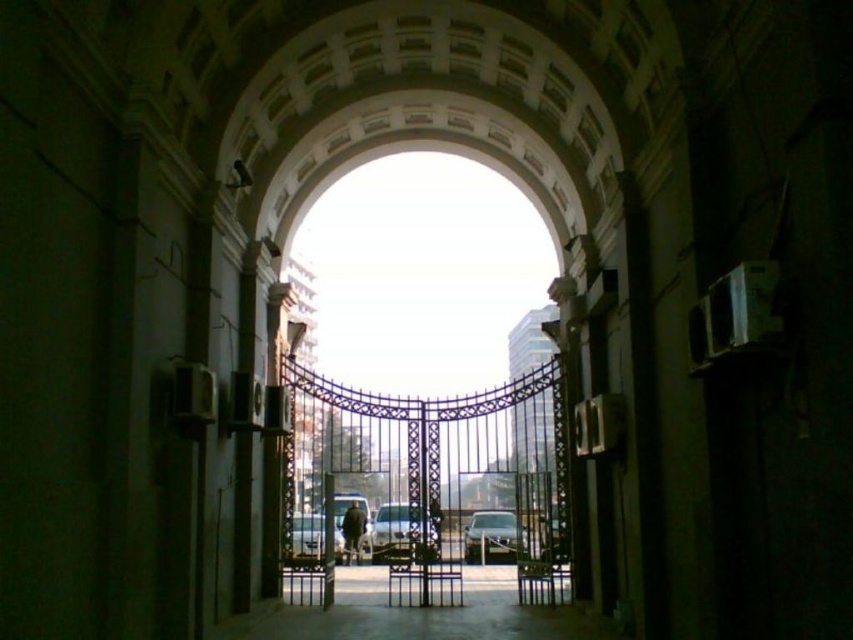
Consider the image. Is silver metallic van at center taller than dark fabric jacket at center?

Yes, silver metallic van at center is taller than dark fabric jacket at center.

Is silver metallic van at center thinner than dark fabric jacket at center?

No.

What do you see at coordinates (399, 531) in the screenshot? I see `silver metallic van at center` at bounding box center [399, 531].

You are a GUI agent. You are given a task and a screenshot of the screen. Output one action in this format:
    pyautogui.click(x=<x>, y=<y>)
    Task: Click on the silver metallic van at center
    This screenshot has width=853, height=640.
    Given the screenshot: What is the action you would take?
    pyautogui.click(x=399, y=531)

Who is more distant from viewer, (489, 554) or (292, 548)?

The point (489, 554) is more distant.

Which is more to the left, satin silver car at center or silver metallic car at center?

silver metallic car at center is more to the left.

Which is in front, point (473, 524) or point (312, 534)?

Point (312, 534)

Locate an element on the screen. The image size is (853, 640). satin silver car at center is located at coordinates (492, 538).

Does silver metallic van at center have a lesser height compared to satin silver car at center?

No.

Is silver metallic van at center thinner than satin silver car at center?

In fact, silver metallic van at center might be wider than satin silver car at center.

Is point (386, 544) in front of point (488, 532)?

That is True.

You are a GUI agent. You are given a task and a screenshot of the screen. Output one action in this format:
    pyautogui.click(x=<x>, y=<y>)
    Task: Click on the silver metallic van at center
    
    Given the screenshot: What is the action you would take?
    pyautogui.click(x=399, y=531)